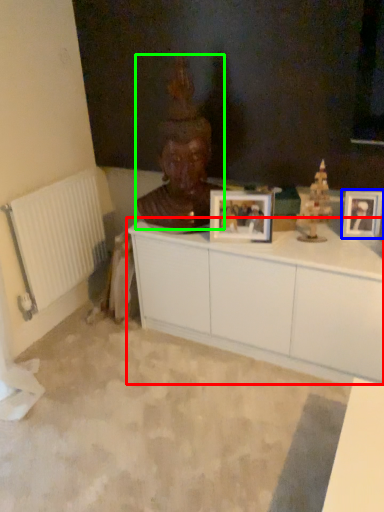
Question: Estimate the real-world distances between objects in this image. Which object is farther from cabinetry (highlighted by a red box), picture frame (highlighted by a blue box) or person (highlighted by a green box)?

Choices:
 (A) picture frame
 (B) person

Answer: (A)